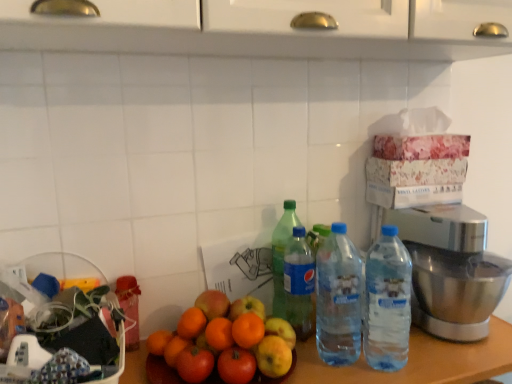
What do you see at coordinates (298, 283) in the screenshot? The width and height of the screenshot is (512, 384). I see `translucent plastic bottle at center, arranged as the third bottle when viewed from the right` at bounding box center [298, 283].

What do you see at coordinates (282, 255) in the screenshot? Image resolution: width=512 pixels, height=384 pixels. I see `green plastic bottle at center, arranged as the 4th bottle when viewed from the right` at bounding box center [282, 255].

What is the approximate height of clear plastic water bottles at center-right, the first bottle positioned from the right?

The height of clear plastic water bottles at center-right, the first bottle positioned from the right, is 12.11 inches.

This screenshot has width=512, height=384. What are the coordinates of `wooden table at center` in the screenshot? It's located at (418, 361).

Would you say green plastic bottle at center, arranged as the first bottle when viewed from the left, is outside clear plastic water bottles at center-right, placed as the 4th bottle when sorted from left to right?

Yes, green plastic bottle at center, arranged as the first bottle when viewed from the left, is outside of clear plastic water bottles at center-right, placed as the 4th bottle when sorted from left to right.

Is the surface of green plastic bottle at center, arranged as the 4th bottle when viewed from the right, in direct contact with clear plastic water bottles at center-right, placed as the 4th bottle when sorted from left to right?

No, green plastic bottle at center, arranged as the 4th bottle when viewed from the right, is not making contact with clear plastic water bottles at center-right, placed as the 4th bottle when sorted from left to right.

Can you confirm if green plastic bottle at center, arranged as the first bottle when viewed from the left, is positioned to the right of clear plastic water bottles at center-right, placed as the 4th bottle when sorted from left to right?

In fact, green plastic bottle at center, arranged as the first bottle when viewed from the left, is to the left of clear plastic water bottles at center-right, placed as the 4th bottle when sorted from left to right.

Considering the positions of objects shiny orange fruit at center and wooden table at center in the image provided, who is more to the left, shiny orange fruit at center or wooden table at center?

shiny orange fruit at center is more to the left.

Would you say shiny orange fruit at center is outside wooden table at center?

Indeed, shiny orange fruit at center is completely outside wooden table at center.

Is shiny orange fruit at center oriented towards wooden table at center?

No, shiny orange fruit at center does not turn towards wooden table at center.

Is shiny orange fruit at center in front of wooden table at center?

No, shiny orange fruit at center is further to the viewer.

At what (x,y) coordinates should I click in order to perform the action: click on bottle on the left of translucent plastic bottle at center, arranged as the third bottle when viewed from the right. Please return your answer as a coordinate pair (x, y). Image resolution: width=512 pixels, height=384 pixels. Looking at the image, I should click on (282, 255).

Are green plastic bottle at center, arranged as the 4th bottle when viewed from the right, and translucent plastic bottle at center, arranged as the third bottle when viewed from the right, far apart?

green plastic bottle at center, arranged as the 4th bottle when viewed from the right, is actually quite close to translucent plastic bottle at center, arranged as the third bottle when viewed from the right.

Is translucent plastic bottle at center, arranged as the third bottle when viewed from the right, at the back of green plastic bottle at center, arranged as the first bottle when viewed from the left?

Correct, green plastic bottle at center, arranged as the first bottle when viewed from the left, is looking away from translucent plastic bottle at center, arranged as the third bottle when viewed from the right.

Which of these two, green plastic bottle at center, arranged as the first bottle when viewed from the left, or translucent plastic bottle at center, placed as the 2th bottle when sorted from left to right, is wider?

translucent plastic bottle at center, placed as the 2th bottle when sorted from left to right.

Is wooden table at center taller than shiny orange fruit at center?

Correct, wooden table at center is much taller as shiny orange fruit at center.

Is wooden table at center not near shiny orange fruit at center?

Actually, wooden table at center and shiny orange fruit at center are a little close together.

Based on their sizes in the image, would you say wooden table at center is bigger or smaller than shiny orange fruit at center?

In the image, wooden table at center appears to be larger than shiny orange fruit at center.

Which object is positioned more to the left, blue plastic water bottle at center, which is the 3th bottle from left to right, or translucent plastic bottle at center, placed as the 2th bottle when sorted from left to right?

translucent plastic bottle at center, placed as the 2th bottle when sorted from left to right.

From the image's perspective, does blue plastic water bottle at center, placed as the second bottle when sorted from right to left, appear lower than translucent plastic bottle at center, arranged as the third bottle when viewed from the right?

Indeed, from the image's perspective, blue plastic water bottle at center, placed as the second bottle when sorted from right to left, is shown beneath translucent plastic bottle at center, arranged as the third bottle when viewed from the right.

Measure the distance from blue plastic water bottle at center, which is the 3th bottle from left to right, to translucent plastic bottle at center, arranged as the third bottle when viewed from the right.

blue plastic water bottle at center, which is the 3th bottle from left to right, and translucent plastic bottle at center, arranged as the third bottle when viewed from the right, are 3.73 inches apart from each other.

Is point (339, 323) positioned behind point (302, 242)?

No, it is not.

Who is more distant, clear plastic water bottles at center-right, the first bottle positioned from the right, or wooden table at center?

Positioned behind is clear plastic water bottles at center-right, the first bottle positioned from the right.

Would you say clear plastic water bottles at center-right, the first bottle positioned from the right, is outside wooden table at center?

Indeed, clear plastic water bottles at center-right, the first bottle positioned from the right, is completely outside wooden table at center.

How much distance is there between clear plastic water bottles at center-right, placed as the 4th bottle when sorted from left to right, and wooden table at center?

clear plastic water bottles at center-right, placed as the 4th bottle when sorted from left to right, and wooden table at center are 4.94 inches apart from each other.

Between translucent plastic bottle at center, placed as the 2th bottle when sorted from left to right, and shiny orange fruit at center, which one is positioned in front?

shiny orange fruit at center.

Does translucent plastic bottle at center, placed as the 2th bottle when sorted from left to right, have a lesser width compared to shiny orange fruit at center?

Yes, translucent plastic bottle at center, placed as the 2th bottle when sorted from left to right, is thinner than shiny orange fruit at center.

Which point is more forward, [309,326] or [196,356]?

The point [196,356] is more forward.

From a real-world perspective, count 1st bottles downward from the green plastic bottle at center, arranged as the first bottle when viewed from the left, and point to it. Please provide its 2D coordinates.

[(387, 302)]

Identify the location of orange on the left of wooden table at center. The image size is (512, 384). (218, 345).

Based on their spatial positions, is clear plastic water bottles at center-right, placed as the 4th bottle when sorted from left to right, or shiny orange fruit at center closer to blue plastic water bottle at center, which is the 3th bottle from left to right?

Based on the image, clear plastic water bottles at center-right, placed as the 4th bottle when sorted from left to right, appears to be nearer to blue plastic water bottle at center, which is the 3th bottle from left to right.

Looking at the image, which one is located further to green plastic bottle at center, arranged as the first bottle when viewed from the left, wooden table at center or blue plastic water bottle at center, placed as the second bottle when sorted from right to left?

Among the two, wooden table at center is located further to green plastic bottle at center, arranged as the first bottle when viewed from the left.

Considering their positions, is wooden table at center positioned closer to shiny orange fruit at center than clear plastic water bottles at center-right, the first bottle positioned from the right?

wooden table at center is positioned closer to the anchor shiny orange fruit at center.

When comparing their distances from shiny orange fruit at center, does blue plastic water bottle at center, which is the 3th bottle from left to right, or polished stainless steel mixer at right seem further?

The object further to shiny orange fruit at center is polished stainless steel mixer at right.

Estimate the real-world distances between objects in this image. Which object is further from wooden table at center, green plastic bottle at center, arranged as the first bottle when viewed from the left, or translucent plastic bottle at center, placed as the 2th bottle when sorted from left to right?

green plastic bottle at center, arranged as the first bottle when viewed from the left, lies further to wooden table at center than the other object.

Looking at the image, which one is located closer to shiny orange fruit at center, clear plastic water bottles at center-right, the first bottle positioned from the right, or wooden table at center?

The object closer to shiny orange fruit at center is wooden table at center.

From the image, which object appears to be nearer to translucent plastic bottle at center, placed as the 2th bottle when sorted from left to right, polished stainless steel mixer at right or green plastic bottle at center, arranged as the 4th bottle when viewed from the right?

green plastic bottle at center, arranged as the 4th bottle when viewed from the right, is positioned closer to the anchor translucent plastic bottle at center, placed as the 2th bottle when sorted from left to right.

Estimate the real-world distances between objects in this image. Which object is closer to translucent plastic bottle at center, placed as the 2th bottle when sorted from left to right, blue plastic water bottle at center, which is the 3th bottle from left to right, or shiny orange fruit at center?

blue plastic water bottle at center, which is the 3th bottle from left to right, is positioned closer to the anchor translucent plastic bottle at center, placed as the 2th bottle when sorted from left to right.

Locate an element on the screen. The width and height of the screenshot is (512, 384). table situated between shiny orange fruit at center and polished stainless steel mixer at right from left to right is located at coordinates (418, 361).

Where is `mixer between green plastic bottle at center, arranged as the first bottle when viewed from the left, and wooden table at center in the up-down direction`? mixer between green plastic bottle at center, arranged as the first bottle when viewed from the left, and wooden table at center in the up-down direction is located at coordinates (450, 269).

This screenshot has width=512, height=384. Find the location of `bottle between blue plastic water bottle at center, placed as the second bottle when sorted from right to left, and polished stainless steel mixer at right, in the horizontal direction`. bottle between blue plastic water bottle at center, placed as the second bottle when sorted from right to left, and polished stainless steel mixer at right, in the horizontal direction is located at coordinates (387, 302).

Identify the location of bottle between translucent plastic bottle at center, arranged as the third bottle when viewed from the right, and clear plastic water bottles at center-right, placed as the 4th bottle when sorted from left to right, in the horizontal direction. This screenshot has width=512, height=384. (338, 298).